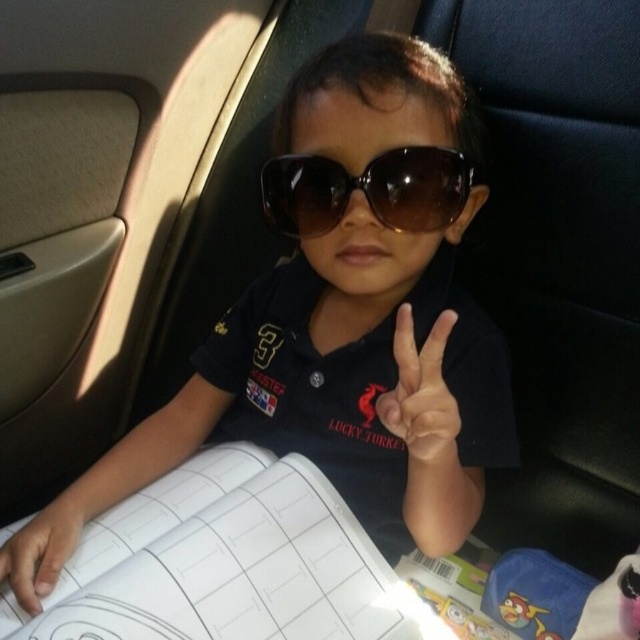
You are taking a photo of the child in the car seat. You notice two points in the image at coordinates point (323, 232) and point (70, 500). Which point is closer to the camera?

Point (323, 232) is closer to the camera than point (70, 500).

You are a photographer standing at a certain distance from the child. You want to take a picture where the brown matte sunglasses at center appears larger in the photo. What should you do?

To make the brown matte sunglasses at center appear larger in the photo, you should move closer to the sunglasses since they are currently 24.12 inches away from the camera. Reducing the distance between the camera and the sunglasses will magnify their size in the photograph.